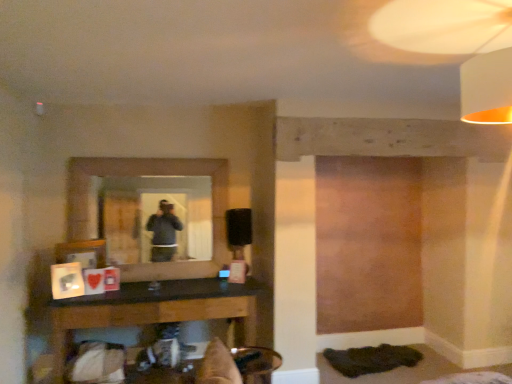
Image resolution: width=512 pixels, height=384 pixels. Describe the element at coordinates (238, 230) in the screenshot. I see `black matte table lamp at center` at that location.

Identify the location of black matte table lamp at center. (238, 230).

Measure the distance between point [184,259] and camera.

Point [184,259] and camera are 12.06 feet apart.

The width and height of the screenshot is (512, 384). In order to click on white fabric lampshade at upper right in this screenshot , I will do `click(458, 46)`.

From a real-world perspective, is white fabric lampshade at upper right physically above metallic gold swivel chair at lower center?

Yes, from a real-world perspective, white fabric lampshade at upper right is over metallic gold swivel chair at lower center

Is metallic gold swivel chair at lower center inside white fabric lampshade at upper right?

That's incorrect, metallic gold swivel chair at lower center is not inside white fabric lampshade at upper right.

Between point (412, 10) and point (239, 355), which one is positioned behind?

The point (239, 355) is behind.

Would you consider white fabric lampshade at upper right to be distant from metallic gold swivel chair at lower center?

Indeed, white fabric lampshade at upper right is not near metallic gold swivel chair at lower center.

Who is smaller, matte glass mirror at center or black wood table at lower center?

matte glass mirror at center.

Is matte glass mirror at center looking in the opposite direction of black wood table at lower center?

No, matte glass mirror at center is not facing away from black wood table at lower center.

The height and width of the screenshot is (384, 512). I want to click on mirror on the left of black wood table at lower center, so click(156, 218).

Considering the positions of objects matte glass mirror at center and black wood table at lower center in the image provided, who is behind, matte glass mirror at center or black wood table at lower center?

matte glass mirror at center is behind.

Is black wood table at lower center aimed at black matte table lamp at center?

No, black wood table at lower center does not turn towards black matte table lamp at center.

From a real-world perspective, between black wood table at lower center and black matte table lamp at center, who is vertically higher?

In real-world perspective, black matte table lamp at center is above.

In terms of width, does black wood table at lower center look wider or thinner when compared to black matte table lamp at center?

Considering their sizes, black wood table at lower center looks broader than black matte table lamp at center.

Consider the image. Is black wood table at lower center surrounding black matte table lamp at center?

No, black wood table at lower center does not contain black matte table lamp at center.

Based on the photo, can black matte table lamp at center be found inside metallic gold swivel chair at lower center?

That's incorrect, black matte table lamp at center is not inside metallic gold swivel chair at lower center.

What's the angular difference between metallic gold swivel chair at lower center and black matte table lamp at center's facing directions?

The facing directions of metallic gold swivel chair at lower center and black matte table lamp at center are 89.3 degrees apart.

From a real-world perspective, is metallic gold swivel chair at lower center physically above black matte table lamp at center?

No, from a real-world perspective, metallic gold swivel chair at lower center is not on top of black matte table lamp at center.

Is point (245, 382) closer to viewer compared to point (502, 51)?

No.

Is metallic gold swivel chair at lower center wider than white fabric lampshade at upper right?

No.

Considering their positions, is metallic gold swivel chair at lower center located in front of or behind white fabric lampshade at upper right?

Clearly, metallic gold swivel chair at lower center is behind white fabric lampshade at upper right.

Is metallic gold swivel chair at lower center shorter than white fabric lampshade at upper right?

Yes, metallic gold swivel chair at lower center is shorter than white fabric lampshade at upper right.

Which is less distant, [134,303] or [264,359]?

Point [134,303] appears to be farther away from the viewer than point [264,359].

From the image's perspective, would you say black wood table at lower center is shown under metallic gold swivel chair at lower center?

Yes, from the image's perspective, black wood table at lower center is beneath metallic gold swivel chair at lower center.

What's the angular difference between black wood table at lower center and metallic gold swivel chair at lower center's facing directions?

90.2 degrees separate the facing orientations of black wood table at lower center and metallic gold swivel chair at lower center.

Considering the sizes of objects black matte table lamp at center and black wood table at lower center in the image provided, who is thinner, black matte table lamp at center or black wood table at lower center?

black matte table lamp at center is thinner.

Is black matte table lamp at center situated inside black wood table at lower center or outside?

black matte table lamp at center is not enclosed by black wood table at lower center.

Is black matte table lamp at center closer to camera compared to black wood table at lower center?

No, black matte table lamp at center is further to the viewer.

Are black matte table lamp at center and black wood table at lower center making contact?

No, black matte table lamp at center is not in contact with black wood table at lower center.

Locate an element on the screen. Image resolution: width=512 pixels, height=384 pixels. swivel chair below the white fabric lampshade at upper right (from the image's perspective) is located at coordinates (256, 363).

Find the location of a particular element. The height and width of the screenshot is (384, 512). mirror behind the black wood table at lower center is located at coordinates (156, 218).

Considering their positions, is matte glass mirror at center positioned closer to metallic gold swivel chair at lower center than black matte table lamp at center?

black matte table lamp at center is positioned closer to the anchor metallic gold swivel chair at lower center.

When comparing their distances from black matte table lamp at center, does matte glass mirror at center or white fabric lampshade at upper right seem closer?

matte glass mirror at center is positioned closer to the anchor black matte table lamp at center.

When comparing their distances from black matte table lamp at center, does white fabric lampshade at upper right or metallic gold swivel chair at lower center seem closer?

The object closer to black matte table lamp at center is metallic gold swivel chair at lower center.

Based on their spatial positions, is black matte table lamp at center or matte glass mirror at center closer to black wood table at lower center?

Among the two, matte glass mirror at center is located nearer to black wood table at lower center.

Looking at the image, which one is located closer to matte glass mirror at center, metallic gold swivel chair at lower center or black matte table lamp at center?

black matte table lamp at center is positioned closer to the anchor matte glass mirror at center.

Looking at this image, considering their positions, is matte glass mirror at center positioned further to white fabric lampshade at upper right than black matte table lamp at center?

matte glass mirror at center.

Considering their positions, is black wood table at lower center positioned closer to matte glass mirror at center than black matte table lamp at center?

black wood table at lower center is closer to matte glass mirror at center.

Looking at the image, which one is located further to white fabric lampshade at upper right, metallic gold swivel chair at lower center or black wood table at lower center?

The object further to white fabric lampshade at upper right is black wood table at lower center.

Image resolution: width=512 pixels, height=384 pixels. What are the coordinates of `mirror between white fabric lampshade at upper right and black matte table lamp at center in the front-back direction` in the screenshot? It's located at (156, 218).

Image resolution: width=512 pixels, height=384 pixels. I want to click on table between white fabric lampshade at upper right and matte glass mirror at center along the z-axis, so click(x=161, y=310).

Locate an element on the screen. table between metallic gold swivel chair at lower center and black matte table lamp at center in the front-back direction is located at coordinates tap(161, 310).

Identify the location of mirror between metallic gold swivel chair at lower center and black matte table lamp at center in the front-back direction. This screenshot has width=512, height=384. (156, 218).